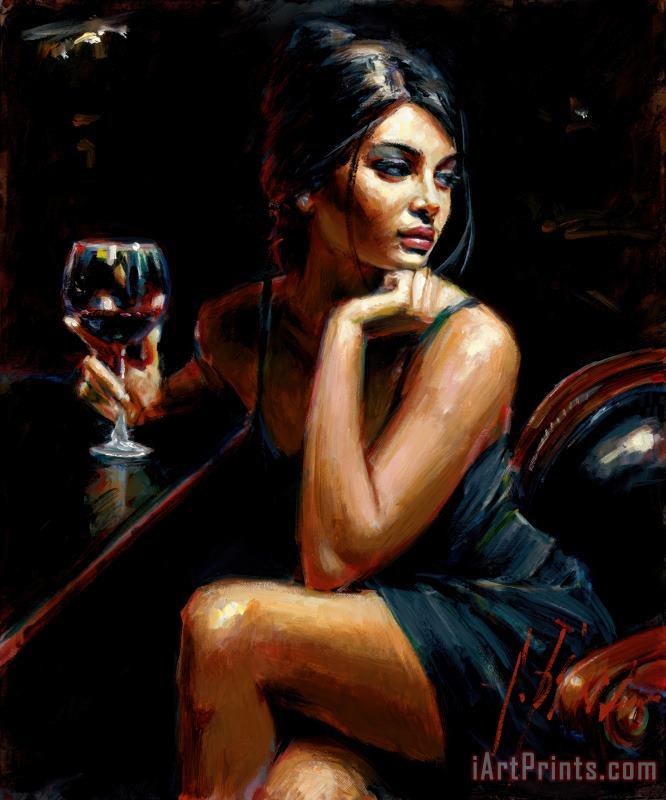
Where is `painting`? painting is located at coordinates [380, 210].